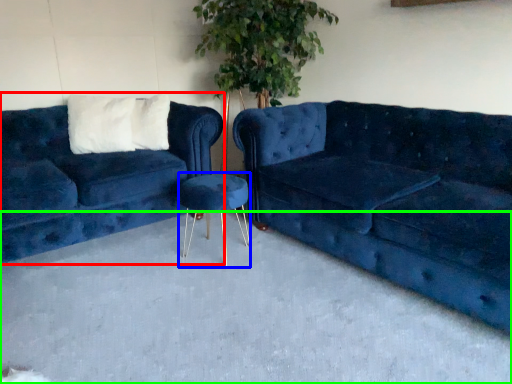
Question: Based on their relative distances, which object is nearer to studio couch (highlighted by a red box)? Choose from bar stool (highlighted by a blue box) and concrete (highlighted by a green box).

Choices:
 (A) bar stool
 (B) concrete

Answer: (A)